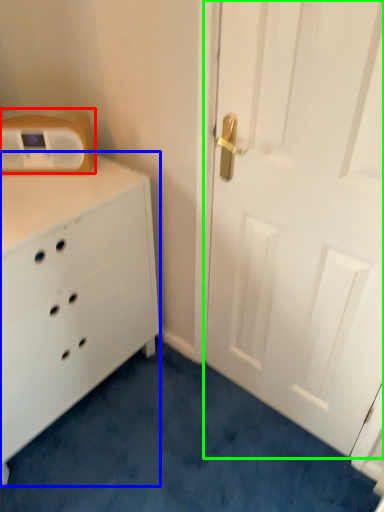
Question: Estimate the real-world distances between objects in this image. Which object is closer to appliance (highlighted by a red box), chest of drawers (highlighted by a blue box) or door (highlighted by a green box)?

Choices:
 (A) chest of drawers
 (B) door

Answer: (A)